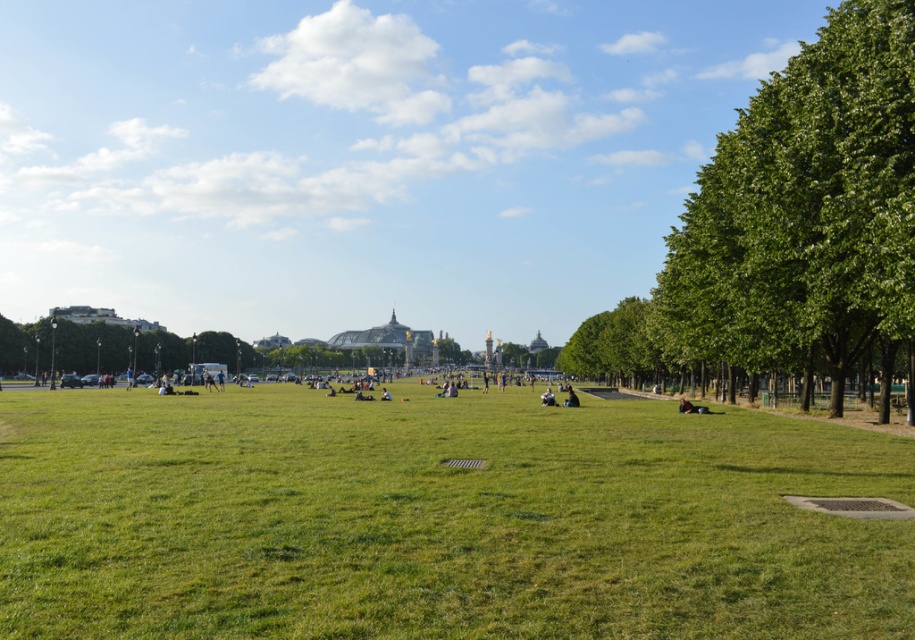
In the scene shown: You are planning to set up a picnic in the park. The green grassy field at center and the green leafy tree at right are both potential spots. Which area has more space for your picnic blanket?

The green leafy tree at right has more space because the green grassy field at center occupies less space than the green leafy tree at right.

You are planning to set up a picnic blanket in the park. The picnic blanket is 10 feet wide. You want to place it between the green grassy field at center and the green leafy tree at right. Is there enough space between them to fit the picnic blanket?

The distance between the green grassy field at center and the green leafy tree at right is 68.49 feet, which is more than enough to accommodate the 10 feet wide picnic blanket.